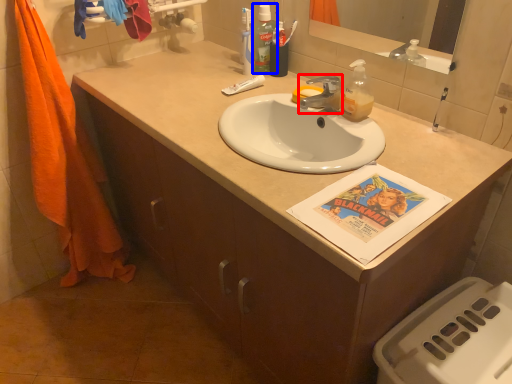
Question: Among these objects, which one is nearest to the camera, faucet (highlighted by a red box) or mouthwash (highlighted by a blue box)?

Choices:
 (A) faucet
 (B) mouthwash

Answer: (A)